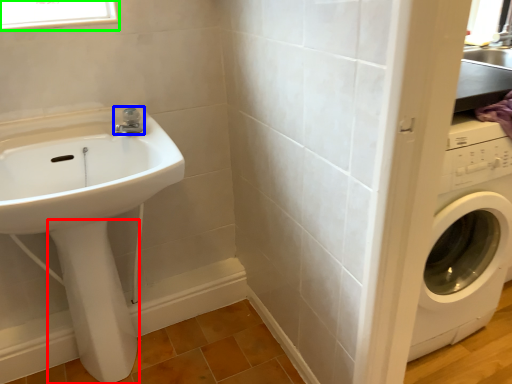
Question: Considering the real-world distances, which object is farthest from bidet (highlighted by a red box)? tap (highlighted by a blue box) or window (highlighted by a green box)?

Choices:
 (A) tap
 (B) window

Answer: (B)